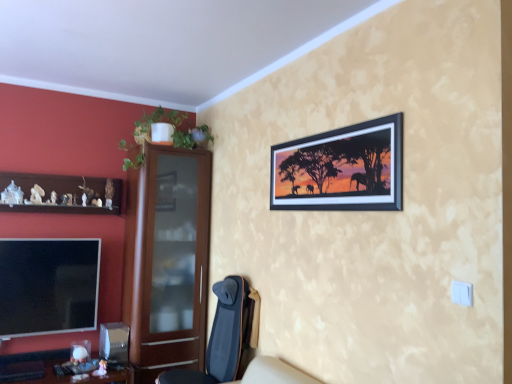
Question: Is black matte picture frame at upper right to the left of brown wooden shelf at left from the viewer's perspective?

Choices:
 (A) no
 (B) yes

Answer: (A)

Question: Is black matte picture frame at upper right outside brown wooden shelf at left?

Choices:
 (A) no
 (B) yes

Answer: (B)

Question: Is black matte picture frame at upper right facing away from brown wooden shelf at left?

Choices:
 (A) yes
 (B) no

Answer: (B)

Question: Does black matte picture frame at upper right lie in front of brown wooden shelf at left?

Choices:
 (A) no
 (B) yes

Answer: (B)

Question: Can you confirm if black matte picture frame at upper right is shorter than brown wooden shelf at left?

Choices:
 (A) yes
 (B) no

Answer: (B)

Question: From a real-world perspective, is brushed wood desk at lower left positioned above or below dark blue fabric chair at lower center?

Choices:
 (A) above
 (B) below

Answer: (B)

Question: From their relative heights in the image, would you say brushed wood desk at lower left is taller or shorter than dark blue fabric chair at lower center?

Choices:
 (A) short
 (B) tall

Answer: (A)

Question: Looking at their shapes, would you say brushed wood desk at lower left is wider or thinner than dark blue fabric chair at lower center?

Choices:
 (A) wide
 (B) thin

Answer: (A)

Question: In terms of size, does brushed wood desk at lower left appear bigger or smaller than dark blue fabric chair at lower center?

Choices:
 (A) small
 (B) big

Answer: (B)

Question: Is brown wooden dresser at left spatially inside black matte picture frame at upper right, or outside of it?

Choices:
 (A) inside
 (B) outside

Answer: (B)

Question: Considering the positions of brown wooden dresser at left and black matte picture frame at upper right in the image, is brown wooden dresser at left bigger or smaller than black matte picture frame at upper right?

Choices:
 (A) big
 (B) small

Answer: (A)

Question: Does point (167, 291) appear closer or farther from the camera than point (399, 152)?

Choices:
 (A) farther
 (B) closer

Answer: (A)

Question: Is brown wooden dresser at left wider or thinner than black matte picture frame at upper right?

Choices:
 (A) thin
 (B) wide

Answer: (B)

Question: Considering the relative positions of flat screen tv at lower left and brushed wood desk at lower left in the image provided, is flat screen tv at lower left to the left or to the right of brushed wood desk at lower left?

Choices:
 (A) right
 (B) left

Answer: (B)

Question: Is flat screen tv at lower left in front of or behind brushed wood desk at lower left in the image?

Choices:
 (A) front
 (B) behind

Answer: (B)